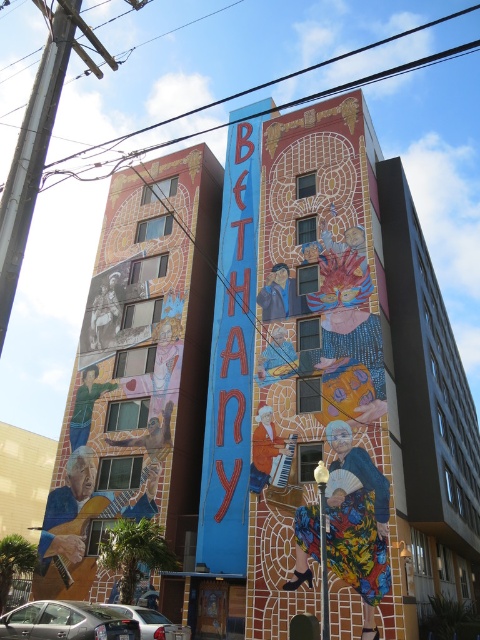
Question: Observing the image, what is the correct spatial positioning of multicolored mosaic at left in reference to silver metallic car at lower left?

Choices:
 (A) left
 (B) right

Answer: (A)

Question: Is multicolored mosaic at left bigger than silver metallic car at lower left?

Choices:
 (A) no
 (B) yes

Answer: (B)

Question: Which point is closer to the camera?

Choices:
 (A) silver metallic car at lower left
 (B) multicolored mosaic at left

Answer: (A)

Question: Is multicolored mosaic at left bigger than silver metallic car at lower left?

Choices:
 (A) no
 (B) yes

Answer: (B)

Question: Among these objects, which one is nearest to the camera?

Choices:
 (A) multicolored mosaic at left
 (B) silver metallic car at lower left

Answer: (B)